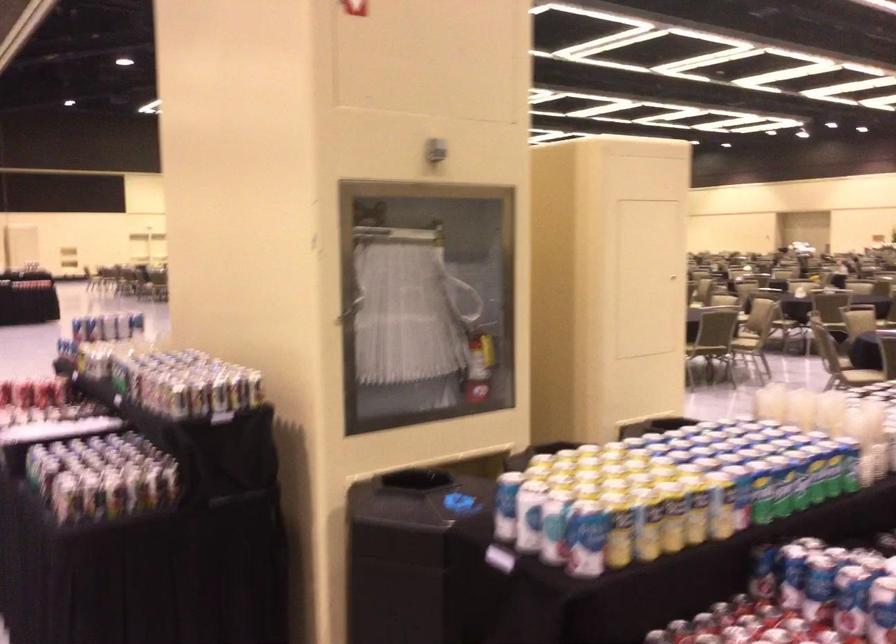
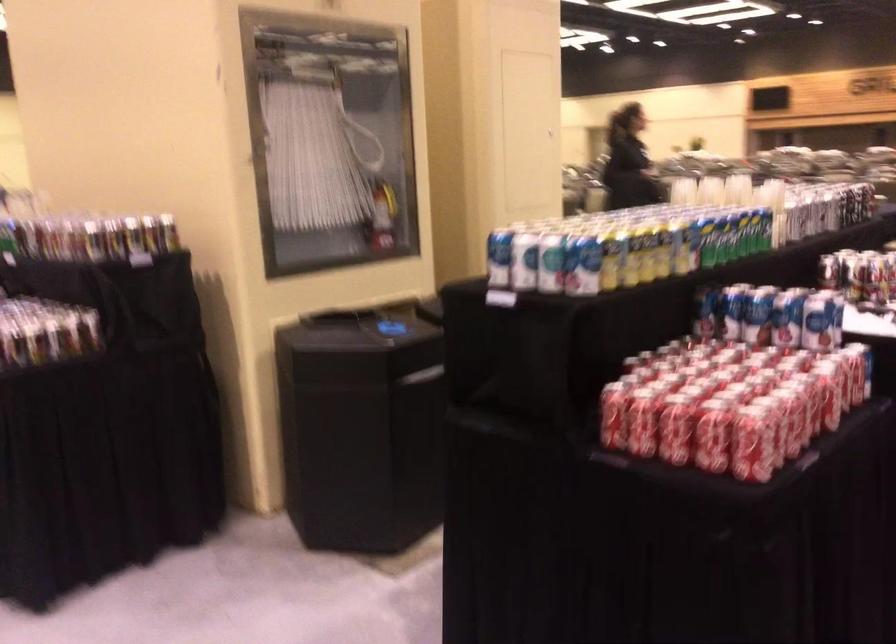
Question: I am providing you with two images of the same scene from different viewpoints. Which of the following objects are not visible in image2?

Choices:
 (A) folded striped blanket
 (B) clear plastic cup
 (C) green and yellow can
 (D) chair sitting surface

Answer: (D)